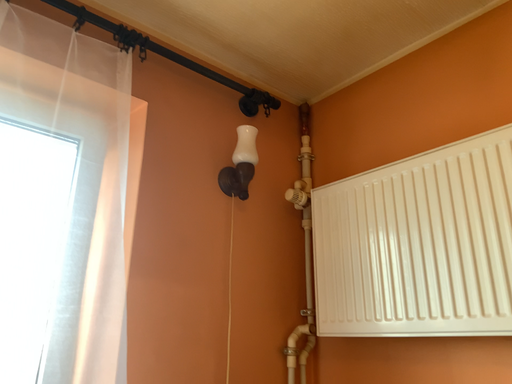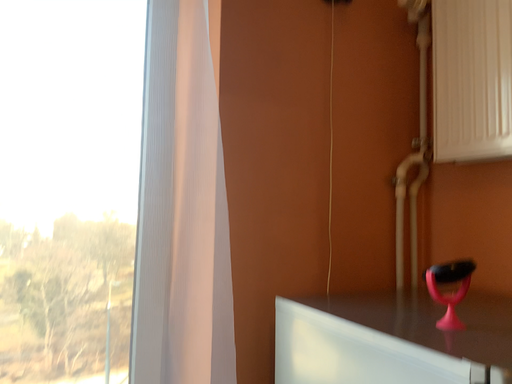
Question: Which way did the camera rotate in the video?

Choices:
 (A) rotated left
 (B) rotated right

Answer: (A)